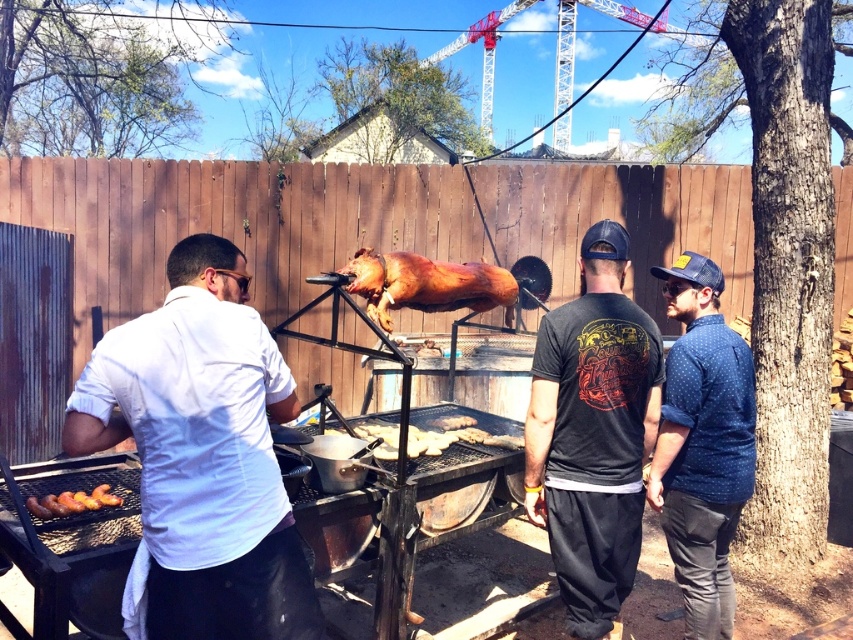
Question: Among these objects, which one is nearest to the camera?

Choices:
 (A) golden brown crusty bread at center
 (B) blue dotted shirt at right
 (C) white matte shirt at center

Answer: (C)

Question: Which point appears farthest from the camera in this image?

Choices:
 (A) (103, 486)
 (B) (689, 577)
 (C) (445, 422)
 (D) (622, 275)

Answer: (C)

Question: From the image, what is the correct spatial relationship of white matte shirt at center in relation to black cotton t-shirt at center?

Choices:
 (A) below
 (B) above

Answer: (B)

Question: Is black cotton t-shirt at center to the right of golden brown crusty bread at center from the viewer's perspective?

Choices:
 (A) no
 (B) yes

Answer: (B)

Question: Which point is farther to the camera?

Choices:
 (A) (80, 497)
 (B) (410, 445)
 (C) (386, 262)
 (D) (614, 380)

Answer: (B)

Question: Does white matte shirt at center appear over golden brown crispy pig at center?

Choices:
 (A) no
 (B) yes

Answer: (A)